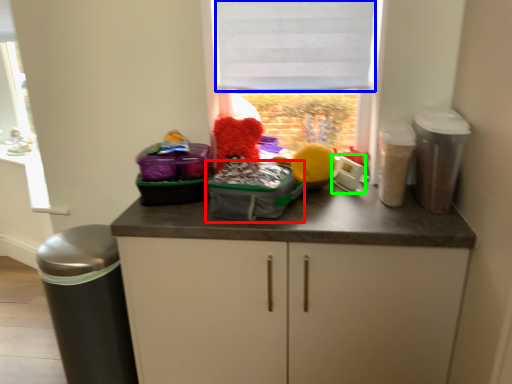
Question: Which object is the farthest from kit (highlighted by a red box)? Choose among these: blind (highlighted by a blue box) or appliance (highlighted by a green box).

Choices:
 (A) blind
 (B) appliance

Answer: (A)